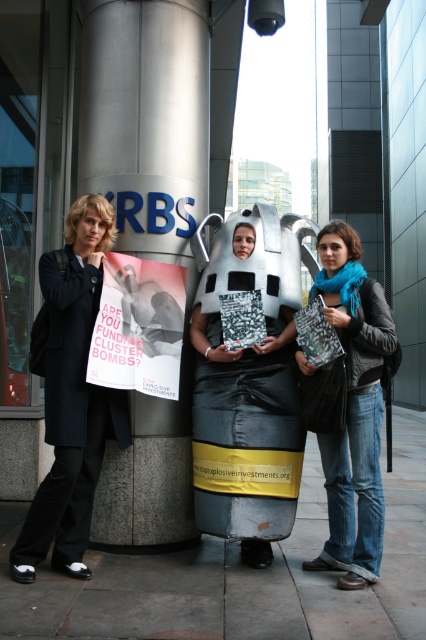
You are a photographer at the scene. You want to capture a photo where the matte black coat at left and blue scarf at center are both visible. Based on their sizes, which object should you ensure is closer to the camera to avoid being cut off?

The matte black coat at left is wider than the blue scarf at center, so to avoid being cut off, ensure the matte black coat at left is closer to the camera.

You are a photographer standing in front of the scene. You want to take a photo that includes both the brushed metal pillar at center and the white paper poster at center. Which object should you focus on first to ensure both are in clear view?

You should focus on the brushed metal pillar at center first because it is closer to you than the white paper poster at center, which is further away. By focusing on the closer object, you can ensure both are in focus.

Based on the scene description, what are the coordinates of the brushed metal pillar at center?

The coordinates of the brushed metal pillar at center are at point (147, 228).